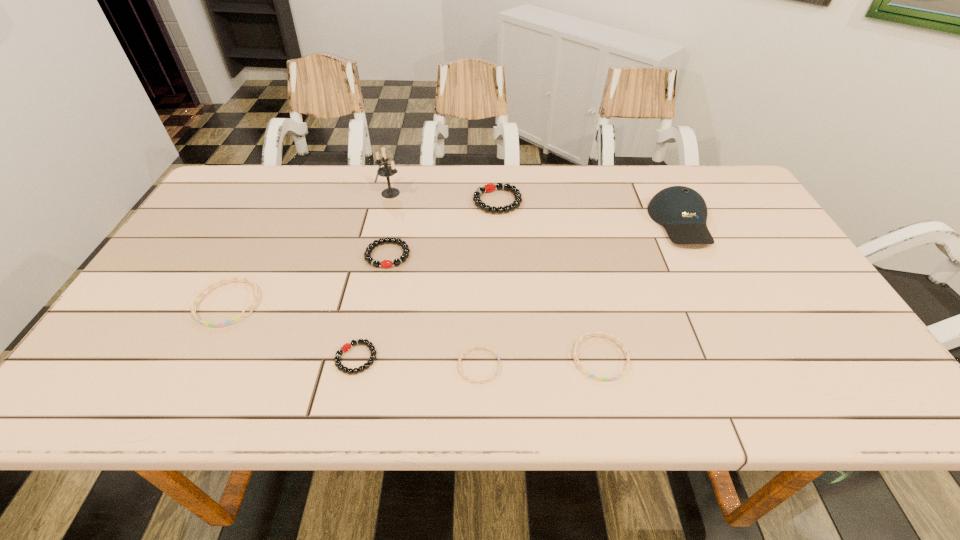
I want to click on free point located on the surface of the shortest object showing star-shaped elements, so click(681, 366).

I want to click on candle holder located at the far edge, so click(x=386, y=171).

Where is `baseball cap at the far edge`? The image size is (960, 540). baseball cap at the far edge is located at coordinates (682, 211).

Where is `bracelet that is at the far edge`? This screenshot has width=960, height=540. bracelet that is at the far edge is located at coordinates [x=490, y=187].

Where is `object at the left edge`? object at the left edge is located at coordinates (236, 318).

Identify the location of object situated at the right edge. (682, 211).

Where is `object located at the far right corner`? This screenshot has height=540, width=960. object located at the far right corner is located at coordinates (682, 211).

In the image, there is a desktop. What are the coordinates of `vacant space at the far edge` in the screenshot? It's located at (441, 172).

At what (x,y) coordinates should I click in order to perform the action: click on free region at the near edge of the desktop. Please return your answer as a coordinate pair (x, y). Looking at the image, I should click on (677, 376).

Find the location of a particular element. This screenshot has width=960, height=540. vacant point at the left edge is located at coordinates (166, 367).